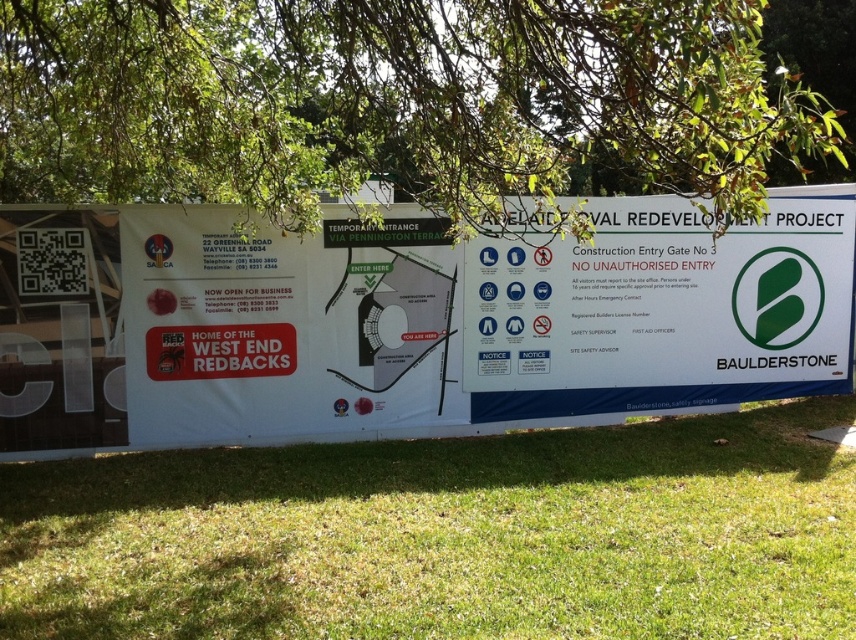
Which is in front, point (292, 205) or point (620, 196)?

Positioned in front is point (292, 205).

Who is positioned more to the left, green leafy tree at upper center or white paper sign at center?

green leafy tree at upper center

Is point (768, 156) positioned behind point (845, 376)?

No.

Identify the location of green leafy tree at upper center. The height and width of the screenshot is (640, 856). (399, 104).

Describe the element at coordinates (447, 536) in the screenshot. The width and height of the screenshot is (856, 640). I see `green grass at lower center` at that location.

Is point (516, 449) more distant than point (642, 280)?

No, (516, 449) is closer to viewer.

Find the location of a particular element. green grass at lower center is located at coordinates (447, 536).

Is green grass at lower center thinner than green leafy tree at upper center?

No, green grass at lower center is not thinner than green leafy tree at upper center.

Is point (480, 630) in front of point (480, 168)?

That is True.

Locate an element on the screen. green grass at lower center is located at coordinates click(x=447, y=536).